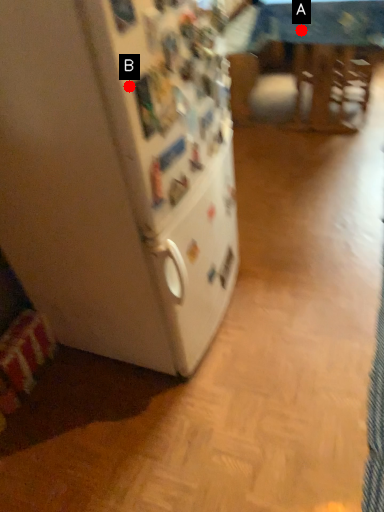
Question: Two points are circled on the image, labeled by A and B beside each circle. Which of the following is the closest to the observer?

Choices:
 (A) A is closer
 (B) B is closer

Answer: (B)